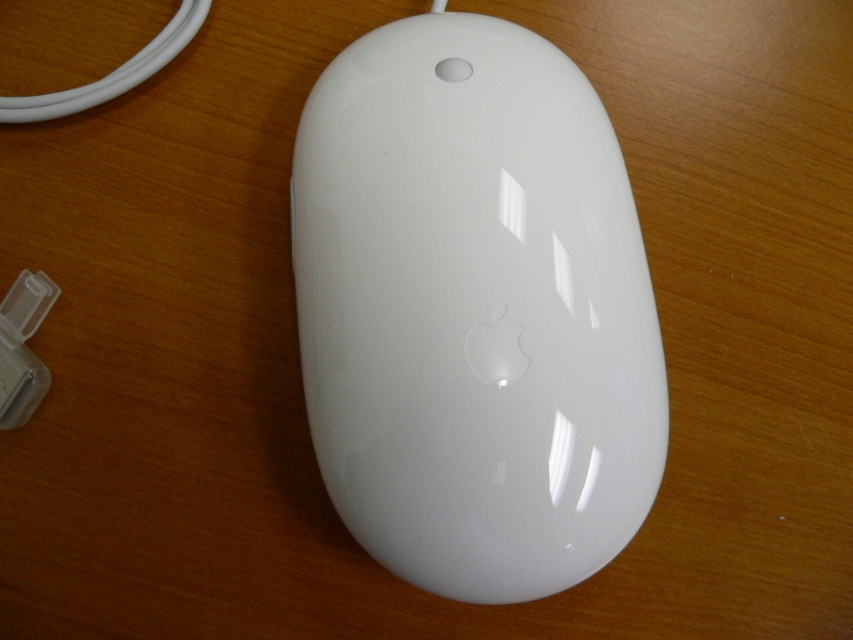
Consider the image. Does white glossy mouse at center have a lesser width compared to clear plastic charger at lower left?

No.

Between point (358, 284) and point (6, 356), which one is positioned in front?

Point (6, 356) is in front.

This screenshot has height=640, width=853. What do you see at coordinates (474, 308) in the screenshot?
I see `white glossy mouse at center` at bounding box center [474, 308].

Locate an element on the screen. The image size is (853, 640). white glossy mouse at center is located at coordinates (474, 308).